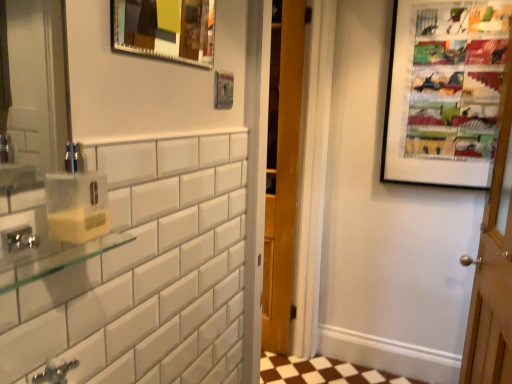
The height and width of the screenshot is (384, 512). I want to click on clear glass shelf at left, so click(x=61, y=261).

Image resolution: width=512 pixels, height=384 pixels. What do you see at coordinates (61, 261) in the screenshot? I see `clear glass shelf at left` at bounding box center [61, 261].

Locate an element on the screen. wooden door at right is located at coordinates pyautogui.click(x=494, y=262).

This screenshot has height=384, width=512. What do you see at coordinates (494, 262) in the screenshot?
I see `wooden door at right` at bounding box center [494, 262].

At what (x,y) coordinates should I click in order to perform the action: click on clear glass shelf at left. Please return your answer as a coordinate pair (x, y). The image size is (512, 384). Looking at the image, I should click on point(61,261).

Is yellow translucent soap dispenser at left oriented away from wooden door at right?

No, yellow translucent soap dispenser at left's orientation is not away from wooden door at right.

Which object is thinner, yellow translucent soap dispenser at left or wooden door at right?

Thinner between the two is wooden door at right.

From a real-world perspective, which object stands above the other?

yellow translucent soap dispenser at left, from a real-world perspective.

How much distance is there between yellow translucent soap dispenser at left and wooden door at right?

yellow translucent soap dispenser at left and wooden door at right are 1.49 meters apart from each other.

Is clear glass shelf at left shorter than yellow translucent soap dispenser at left?

Yes, clear glass shelf at left is shorter than yellow translucent soap dispenser at left.

Is clear glass shelf at left to the left of yellow translucent soap dispenser at left from the viewer's perspective?

Yes.

Could you tell me if clear glass shelf at left is turned towards yellow translucent soap dispenser at left?

No.

Which of these two, clear glass shelf at left or yellow translucent soap dispenser at left, is bigger?

Bigger between the two is yellow translucent soap dispenser at left.

From a real-world perspective, does yellow translucent soap dispenser at left stand above metallic silver picture frame at upper center, the 2th picture frame when ordered from front to back?

Actually, yellow translucent soap dispenser at left is physically below metallic silver picture frame at upper center, the 2th picture frame when ordered from front to back, in the real world.

This screenshot has width=512, height=384. I want to click on the 1st picture frame positioned above the yellow translucent soap dispenser at left (from a real-world perspective), so 224,90.

Is yellow translucent soap dispenser at left oriented towards metallic silver picture frame at upper center, the 2th picture frame positioned from the back?

No, yellow translucent soap dispenser at left is not aimed at metallic silver picture frame at upper center, the 2th picture frame positioned from the back.

Can you confirm if yellow translucent soap dispenser at left is positioned to the right of metallic silver picture frame at upper center, the 2th picture frame in the left-to-right sequence?

No.

Considering the relative sizes of yellow translucent soap dispenser at left and metallic silver picture frame at upper center, the 3th picture frame positioned from the back, in the image provided, is yellow translucent soap dispenser at left smaller than metallic silver picture frame at upper center, the 3th picture frame positioned from the back,?

Yes, yellow translucent soap dispenser at left is smaller than metallic silver picture frame at upper center, the 3th picture frame positioned from the back.

From a real-world perspective, who is located lower, yellow translucent soap dispenser at left or metallic silver picture frame at upper center, marked as the 1th picture frame in a front-to-back arrangement?

In real-world perspective, yellow translucent soap dispenser at left is lower.

You are a GUI agent. You are given a task and a screenshot of the screen. Output one action in this format:
    pyautogui.click(x=<x>, y=<y>)
    Task: Click on the soap dispenser on the left of metallic silver picture frame at upper center, acting as the first picture frame starting from the left
    This screenshot has height=384, width=512.
    Given the screenshot: What is the action you would take?
    pyautogui.click(x=76, y=201)

From the image's perspective, between yellow translucent soap dispenser at left and metallic silver picture frame at upper center, acting as the first picture frame starting from the left, which one is located above?

metallic silver picture frame at upper center, acting as the first picture frame starting from the left, from the image's perspective.

Are metallic silver picture frame at upper center, the 3th picture frame positioned from the back, and clear glass shelf at left far apart?

metallic silver picture frame at upper center, the 3th picture frame positioned from the back, is far away from clear glass shelf at left.

From a real-world perspective, between metallic silver picture frame at upper center, the 3th picture frame in the right-to-left sequence, and clear glass shelf at left, who is vertically lower?

From a 3D spatial view, clear glass shelf at left is below.

Is metallic silver picture frame at upper center, the 3th picture frame positioned from the back, bigger than clear glass shelf at left?

Yes.

Is metallic silver picture frame at upper center, the 3th picture frame in the right-to-left sequence, inside or outside of clear glass shelf at left?

The correct answer is: outside.

From a real-world perspective, who is located higher, clear glass shelf at left or metallic silver picture frame at upper center, acting as the 2th picture frame starting from the right?

From a 3D spatial view, metallic silver picture frame at upper center, acting as the 2th picture frame starting from the right, is above.

From the picture: Is clear glass shelf at left far from metallic silver picture frame at upper center, the 2th picture frame when ordered from front to back?

That's not correct — clear glass shelf at left is a little close to metallic silver picture frame at upper center, the 2th picture frame when ordered from front to back.

Is point (44, 268) closer to camera compared to point (217, 82)?

That is True.

Does clear glass shelf at left appear on the right side of metallic silver picture frame at upper center, the 2th picture frame positioned from the back?

In fact, clear glass shelf at left is to the left of metallic silver picture frame at upper center, the 2th picture frame positioned from the back.

Between metallic silver picture frame at upper center, acting as the 2th picture frame starting from the right, and metallic silver picture frame at upper center, marked as the 1th picture frame in a front-to-back arrangement, which one has more height?

With more height is metallic silver picture frame at upper center, marked as the 1th picture frame in a front-to-back arrangement.

From the image's perspective, is metallic silver picture frame at upper center, the 2th picture frame positioned from the back, positioned above or below metallic silver picture frame at upper center, the 3th picture frame in the right-to-left sequence?

metallic silver picture frame at upper center, the 2th picture frame positioned from the back, is situated lower than metallic silver picture frame at upper center, the 3th picture frame in the right-to-left sequence, in the image.

Is the surface of metallic silver picture frame at upper center, the 2th picture frame positioned from the back, in direct contact with metallic silver picture frame at upper center, acting as the first picture frame starting from the left?

There is a gap between metallic silver picture frame at upper center, the 2th picture frame positioned from the back, and metallic silver picture frame at upper center, acting as the first picture frame starting from the left.

How many degrees apart are the facing directions of metallic silver picture frame at upper center, the 2th picture frame in the left-to-right sequence, and metallic silver picture frame at upper center, the 3th picture frame in the right-to-left sequence?

The angle between the facing direction of metallic silver picture frame at upper center, the 2th picture frame in the left-to-right sequence, and the facing direction of metallic silver picture frame at upper center, the 3th picture frame in the right-to-left sequence, is 1.81 degrees.

Identify the location of door on the right of yellow translucent soap dispenser at left. The height and width of the screenshot is (384, 512). (494, 262).

The height and width of the screenshot is (384, 512). In order to click on balustrade on the left of the yellow translucent soap dispenser at left in this screenshot , I will do `click(61, 261)`.

From the image, which object appears to be nearer to clear glass shelf at left, wooden door at right or metallic silver picture frame at upper center, the 2th picture frame in the left-to-right sequence?

The object closer to clear glass shelf at left is metallic silver picture frame at upper center, the 2th picture frame in the left-to-right sequence.

Looking at the image, which one is located further to yellow translucent soap dispenser at left, metallic silver picture frame at upper center, the 2th picture frame when ordered from front to back, or metallic silver picture frame at upper center, marked as the 1th picture frame in a front-to-back arrangement?

metallic silver picture frame at upper center, marked as the 1th picture frame in a front-to-back arrangement, is positioned further to the anchor yellow translucent soap dispenser at left.

From the image, which object appears to be nearer to metallic silver picture frame at upper center, the 2th picture frame positioned from the back, wooden door at right or yellow translucent soap dispenser at left?

Among the two, yellow translucent soap dispenser at left is located nearer to metallic silver picture frame at upper center, the 2th picture frame positioned from the back.

Considering their positions, is wooden door at right positioned closer to metallic silver picture frame at upper center, the 2th picture frame positioned from the back, than matte black picture frame at upper right, the third picture frame in the left-to-right sequence?

The object closer to metallic silver picture frame at upper center, the 2th picture frame positioned from the back, is wooden door at right.

Based on their spatial positions, is yellow translucent soap dispenser at left or metallic silver picture frame at upper center, marked as the 1th picture frame in a front-to-back arrangement, further from matte black picture frame at upper right, which appears as the 1th picture frame when viewed from the right?

yellow translucent soap dispenser at left.

Estimate the real-world distances between objects in this image. Which object is closer to metallic silver picture frame at upper center, acting as the 2th picture frame starting from the right, metallic silver picture frame at upper center, the 3th picture frame in the right-to-left sequence, or matte black picture frame at upper right, which appears as the 1th picture frame when viewed from the right?

metallic silver picture frame at upper center, the 3th picture frame in the right-to-left sequence.

Which object lies nearer to the anchor point metallic silver picture frame at upper center, the 3th picture frame positioned from the back, clear glass shelf at left or wooden door at right?

The object closer to metallic silver picture frame at upper center, the 3th picture frame positioned from the back, is clear glass shelf at left.

Based on the photo, looking at the image, which one is located further to matte black picture frame at upper right, the 1th picture frame viewed from the back, metallic silver picture frame at upper center, the 2th picture frame in the left-to-right sequence, or wooden door at right?

metallic silver picture frame at upper center, the 2th picture frame in the left-to-right sequence, is further to matte black picture frame at upper right, the 1th picture frame viewed from the back.

This screenshot has width=512, height=384. I want to click on door located between metallic silver picture frame at upper center, the 3th picture frame in the right-to-left sequence, and matte black picture frame at upper right, the 1th picture frame viewed from the back, in the depth direction, so click(x=494, y=262).

Identify the location of soap dispenser between clear glass shelf at left and wooden door at right. [x=76, y=201].

Where is `picture frame between metallic silver picture frame at upper center, the 3th picture frame positioned from the back, and matte black picture frame at upper right, which appears as the 1th picture frame when viewed from the right, along the z-axis`? picture frame between metallic silver picture frame at upper center, the 3th picture frame positioned from the back, and matte black picture frame at upper right, which appears as the 1th picture frame when viewed from the right, along the z-axis is located at coordinates (224, 90).

Locate an element on the screen. picture frame between metallic silver picture frame at upper center, acting as the first picture frame starting from the left, and wooden door at right, in the horizontal direction is located at coordinates (224, 90).